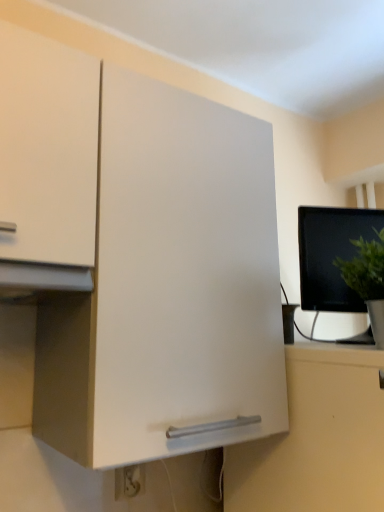
Image resolution: width=384 pixels, height=512 pixels. Describe the element at coordinates (331, 255) in the screenshot. I see `black glossy monitor at right` at that location.

Where is `white plastic electric outlet at lower center`? The height and width of the screenshot is (512, 384). white plastic electric outlet at lower center is located at coordinates (133, 480).

This screenshot has width=384, height=512. Identify the location of black glossy monitor at right. (331, 255).

Would you say green matte plant at right is outside white plastic electric outlet at lower center?

Indeed, green matte plant at right is completely outside white plastic electric outlet at lower center.

Consider the image. Considering their positions, is green matte plant at right located in front of or behind white plastic electric outlet at lower center?

Clearly, green matte plant at right is in front of white plastic electric outlet at lower center.

Considering the points (377, 331) and (144, 482), which point is in front, point (377, 331) or point (144, 482)?

Positioned in front is point (377, 331).

From the image's perspective, does white plastic electric outlet at lower center appear lower than green matte plant at right?

Yes, from the image's perspective, white plastic electric outlet at lower center is below green matte plant at right.

From a real-world perspective, is white plastic electric outlet at lower center beneath green matte plant at right?

Indeed, from a real-world perspective, white plastic electric outlet at lower center is positioned beneath green matte plant at right.

Would you say white plastic electric outlet at lower center is inside or outside green matte plant at right?

white plastic electric outlet at lower center exists outside the volume of green matte plant at right.

Locate an element on the screen. The height and width of the screenshot is (512, 384). electric outlet behind the green matte plant at right is located at coordinates (133, 480).

Which of these two, black glossy monitor at right or green matte plant at right, is smaller?

green matte plant at right is smaller.

From a real-world perspective, is black glossy monitor at right physically above green matte plant at right?

Yes, from a real-world perspective, black glossy monitor at right is on top of green matte plant at right.

Is black glossy monitor at right spatially inside green matte plant at right, or outside of it?

The correct answer is: outside.

Does black glossy monitor at right turn towards green matte plant at right?

Yes, black glossy monitor at right faces towards green matte plant at right.

Is point (370, 213) farther from viewer compared to point (144, 479)?

Yes, it is.

In the image, is black glossy monitor at right positioned in front of or behind white plastic electric outlet at lower center?

Visually, black glossy monitor at right is located behind white plastic electric outlet at lower center.

Is black glossy monitor at right with white plastic electric outlet at lower center?

No.

From a real-world perspective, is black glossy monitor at right positioned above or below white plastic electric outlet at lower center?

In terms of real-world spatial position, black glossy monitor at right is above white plastic electric outlet at lower center.

In the scene shown: Considering the relative positions of green matte plant at right and black glossy monitor at right in the image provided, is green matte plant at right to the left of black glossy monitor at right from the viewer's perspective?

Incorrect, green matte plant at right is not on the left side of black glossy monitor at right.

Could you tell me if green matte plant at right is turned towards black glossy monitor at right?

No.

Is green matte plant at right bigger or smaller than black glossy monitor at right?

In the image, green matte plant at right appears to be smaller than black glossy monitor at right.

From the image's perspective, which object appears higher, white plastic electric outlet at lower center or black glossy monitor at right?

black glossy monitor at right.

Which of these two, white plastic electric outlet at lower center or black glossy monitor at right, is smaller?

white plastic electric outlet at lower center is smaller.

Are white plastic electric outlet at lower center and black glossy monitor at right far apart?

They are positioned close to each other.

Does white plastic electric outlet at lower center have a lesser width compared to black glossy monitor at right?

Yes, white plastic electric outlet at lower center is thinner than black glossy monitor at right.

Where is `houseplant above the white plastic electric outlet at lower center (from the image's perspective)`? houseplant above the white plastic electric outlet at lower center (from the image's perspective) is located at coordinates (367, 285).

The width and height of the screenshot is (384, 512). Find the location of `electric outlet beneath the green matte plant at right (from a real-world perspective)`. electric outlet beneath the green matte plant at right (from a real-world perspective) is located at coordinates (133, 480).

Estimate the real-world distances between objects in this image. Which object is closer to black glossy monitor at right, white plastic electric outlet at lower center or green matte plant at right?

green matte plant at right.

Considering their positions, is black glossy monitor at right positioned closer to white plastic electric outlet at lower center than green matte plant at right?

green matte plant at right is closer to white plastic electric outlet at lower center.

From the image, which object appears to be farther from black glossy monitor at right, green matte plant at right or white plastic electric outlet at lower center?

white plastic electric outlet at lower center lies further to black glossy monitor at right than the other object.

Looking at the image, which one is located closer to green matte plant at right, black glossy monitor at right or white plastic electric outlet at lower center?

black glossy monitor at right.

Based on their spatial positions, is green matte plant at right or black glossy monitor at right closer to white plastic electric outlet at lower center?

green matte plant at right.

When comparing their distances from green matte plant at right, does white plastic electric outlet at lower center or black glossy monitor at right seem further?

The object further to green matte plant at right is white plastic electric outlet at lower center.

Locate an element on the screen. computer monitor located between white plastic electric outlet at lower center and green matte plant at right in the left-right direction is located at coordinates (331, 255).